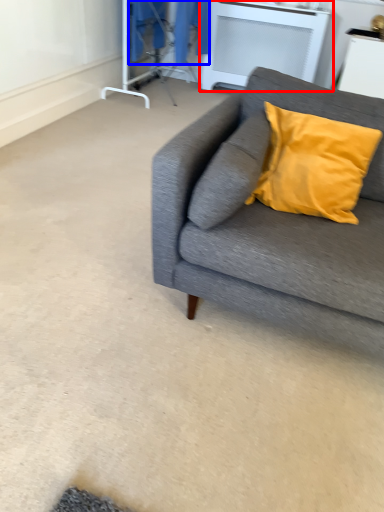
Question: Which of the following is the closest to the observer, table (highlighted by a red box) or laundry (highlighted by a blue box)?

Choices:
 (A) table
 (B) laundry

Answer: (B)